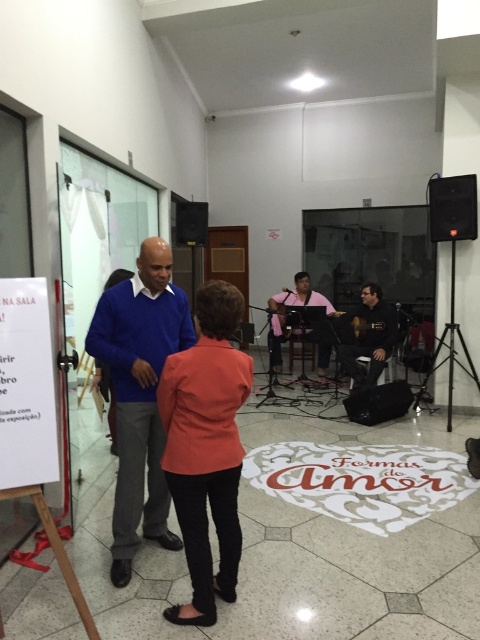
You are standing in the hall and want to find the matte black guitar at center. According to the coordinates provided, where should you look relative to the two people in the foreground?

The matte black guitar at center is located at coordinates point (369, 337), which is to the right and slightly behind the two people in the foreground.

You are a photographer setting up for a photoshoot in this space. You need to position a light source between the matte black guitar at center and the black fabric speaker at lower right. Based on their positions, which object should the light be placed closer to?

The light should be placed closer to the matte black guitar at center since it is positioned to the left of the black fabric speaker at lower right, meaning the space between them can be divided with the light closer to the guitar.

You are a photographer standing at the entrance of the hall. You want to take a photo of the blue sweater at center and the black plastic speaker at upper center such that both are in focus. The camera you are using has a depth of field that can cover 12 feet. Is it possible to capture both objects in focus without moving your position?

The distance between the blue sweater at center and the black plastic speaker at upper center is 13.15 feet. Since the camera can only cover 12 feet, it is not possible to capture both in focus without moving your position.